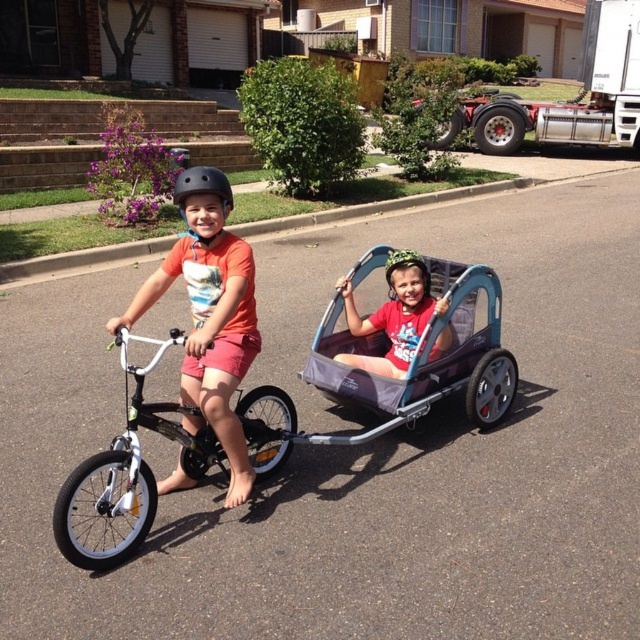
You are a delivery person who needs to place both the black matte bicycle helmet at upper center and the matte black helmet at center into a small box. Which helmet should you choose to fit into the box first?

The black matte bicycle helmet at upper center occupies less space than the matte black helmet at center, so you should place it first to ensure both can fit into the small box.

You are a delivery person who needs to deliver two helmets. The first is the black matte bicycle helmet at upper center and the second is the matte black helmet at center. Based on the scene, which helmet is closer to you?

The black matte bicycle helmet at upper center is closer to you because it is in front of the matte black helmet at center.

You are a safety inspector checking helmets in the image. You need to determine which helmet is taller. The orange matte helmet at center and the black matte bicycle helmet at upper center are both present. Which one is taller?

The orange matte helmet at center has a greater height compared to the black matte bicycle helmet at upper center, so the orange matte helmet at center is taller.